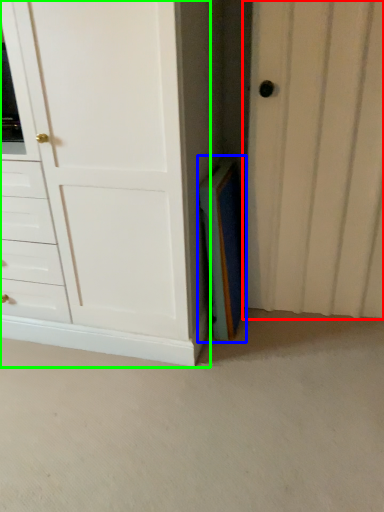
Question: Estimate the real-world distances between objects in this image. Which object is closer to door (highlighted by a red box), paperback book (highlighted by a blue box) or chest of drawers (highlighted by a green box)?

Choices:
 (A) paperback book
 (B) chest of drawers

Answer: (A)